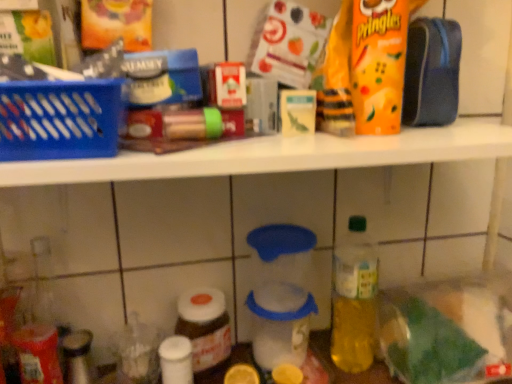
In order to click on vacant region to the right of blue plastic basket at left in this screenshot , I will do `click(203, 150)`.